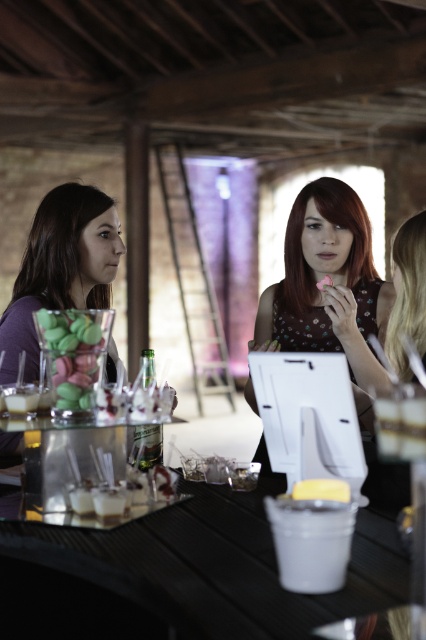
You are a guest at this event and want to place a small gift between the matte glass jar at center and the yellow matte cake at center. If the gift is 20 centimeters wide, will there be enough space between them to fit it?

The distance between the matte glass jar at center and the yellow matte cake at center is 54.25 centimeters. Since the gift is only 20 centimeters wide, there is sufficient space to place it between them.

You are standing at the entrance of the venue and see the matte floral dress at center and the matte purple shirt at left. Which one is closer to you?

The matte purple shirt at left is closer to you because it is below the matte floral dress at center, which is positioned above it.

What is the location of the matte glass jar at center in the image?

The matte glass jar at center is located at point (74, 355) in the image.